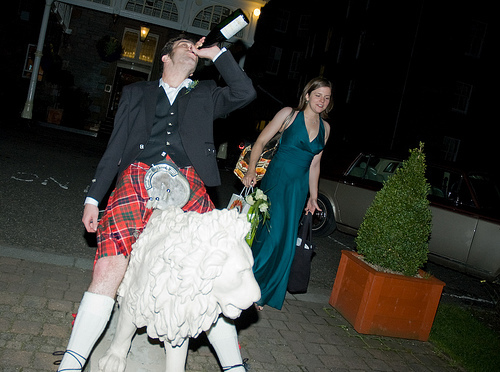
This screenshot has height=372, width=500. I want to click on green plant, so click(403, 252).